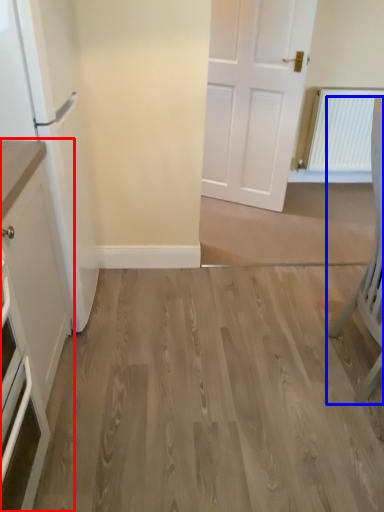
Question: Which object is further to the camera taking this photo, cabinetry (highlighted by a red box) or chair (highlighted by a blue box)?

Choices:
 (A) cabinetry
 (B) chair

Answer: (B)